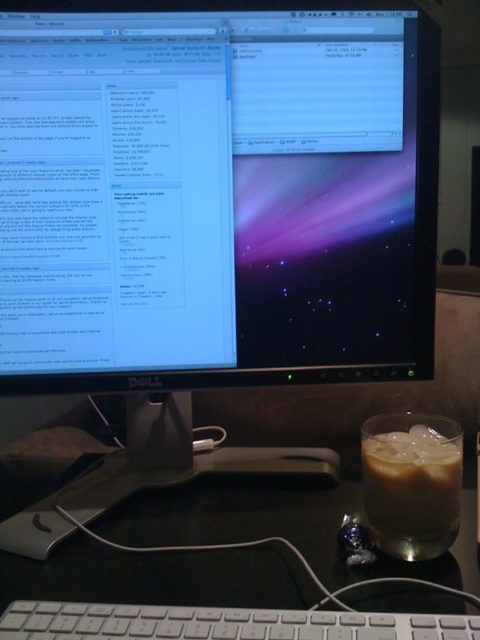
You are organizing your desk and want to move the iced coffee at right closer to the white plastic keyboard at bottom. Based on their current positions, which direction should you move the iced coffee to be closer to the keyboard?

The white plastic keyboard at bottom is in front of the iced coffee at right, so to move the iced coffee closer to the keyboard, you should move it forward towards the front of the desk.

You are setting up a new desk and want to place a mouse next to the white plastic keyboard at bottom. According to the image, where should you position the mouse relative to the keyboard?

The mouse should be positioned to the right of the white plastic keyboard at bottom since the keyboard is located at point (x=220, y=624), which places it near the bottom edge of the frame.

You are organizing a workspace and need to place a new item between the black plastic table at lower center and the iced coffee at right. Which object should you place the item closer to if it requires more height?

You should place the item closer to the iced coffee at right because it is taller than the black plastic table at lower center.